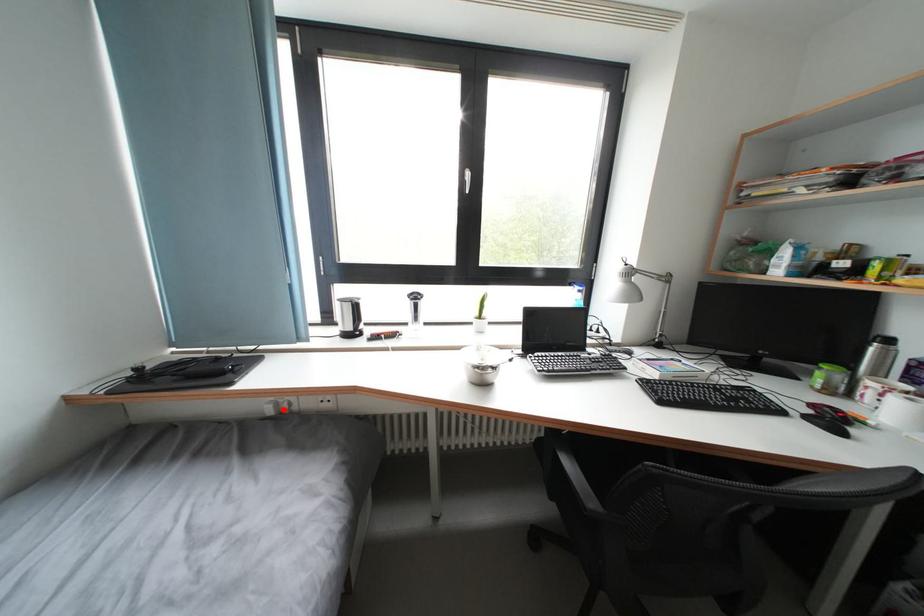
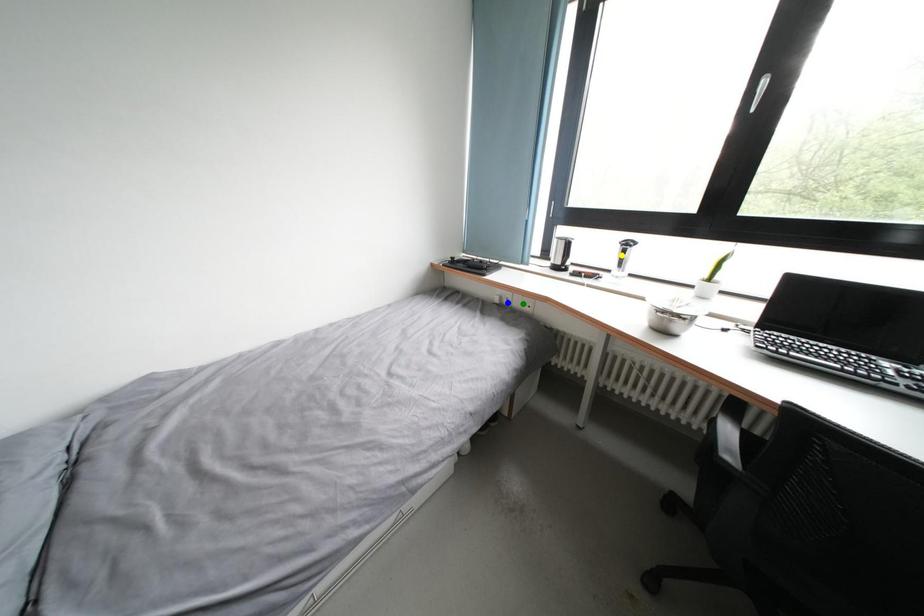
Question: I am providing you with two images of the same scene from different viewpoints. A red point is marked on the first image. You are given multiple points on the second image. Which mark in image 2 goes with the point in image 1?

Choices:
 (A) green point
 (B) yellow point
 (C) blue point

Answer: (C)